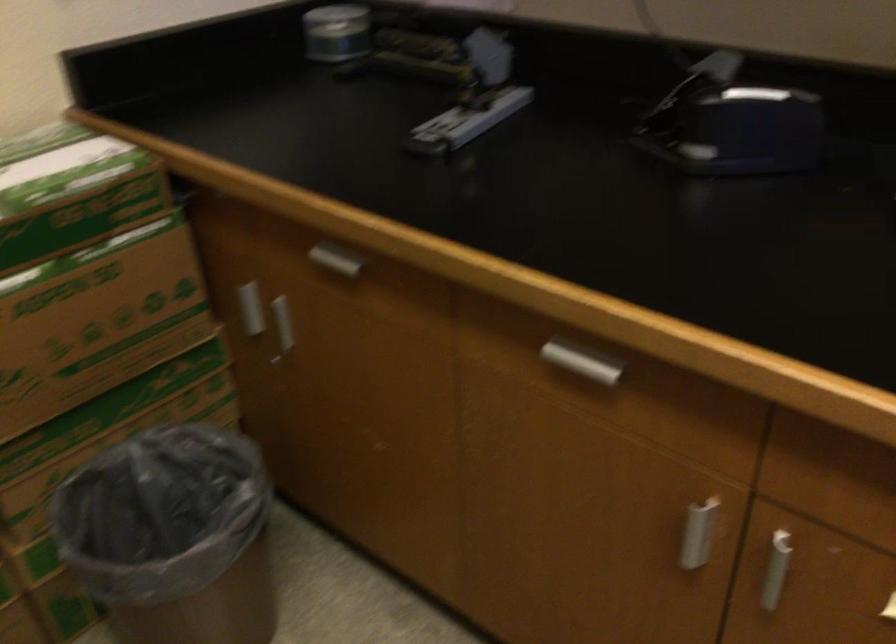
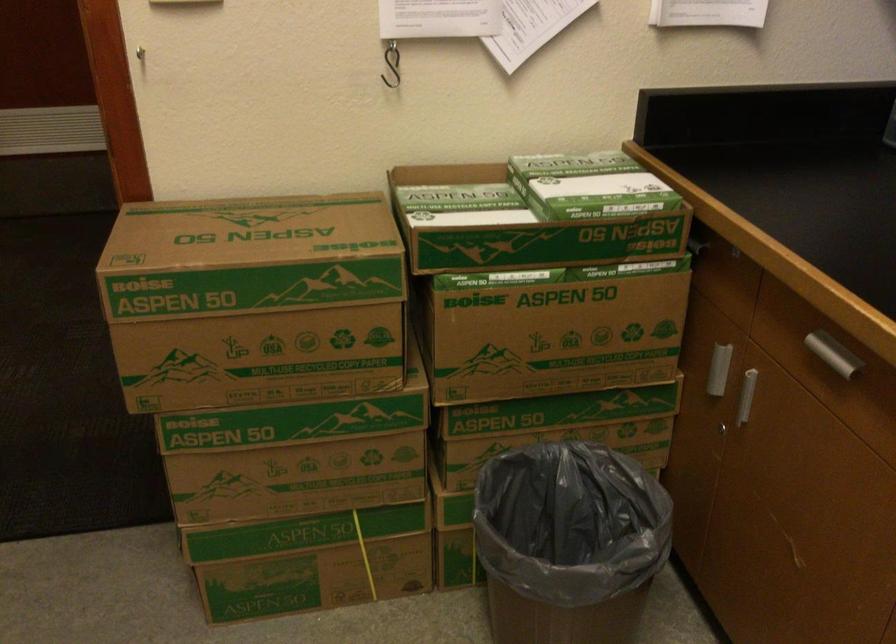
Find the pixel in the second image that matches point (339, 254) in the first image.

(831, 353)